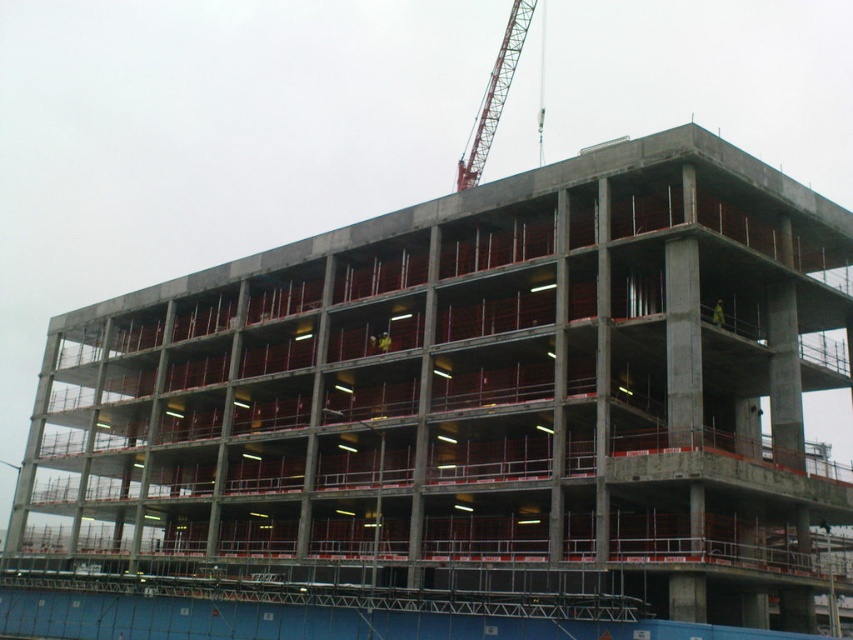
Question: Which object appears farthest from the camera in this image?

Choices:
 (A) metallic red crane at upper center
 (B) yellow reflective vest at upper center

Answer: (A)

Question: Which object is closer to the camera taking this photo?

Choices:
 (A) yellow reflective vest at upper center
 (B) metallic red crane at upper center

Answer: (A)

Question: Which point appears closest to the camera in this image?

Choices:
 (A) (712, 324)
 (B) (502, 51)

Answer: (A)

Question: Can you confirm if metallic red crane at upper center is positioned to the left of yellow reflective vest at upper center?

Choices:
 (A) yes
 (B) no

Answer: (A)

Question: Does metallic red crane at upper center appear on the right side of yellow reflective vest at upper center?

Choices:
 (A) no
 (B) yes

Answer: (A)

Question: Can you confirm if metallic red crane at upper center is positioned to the left of yellow reflective vest at upper center?

Choices:
 (A) yes
 (B) no

Answer: (A)